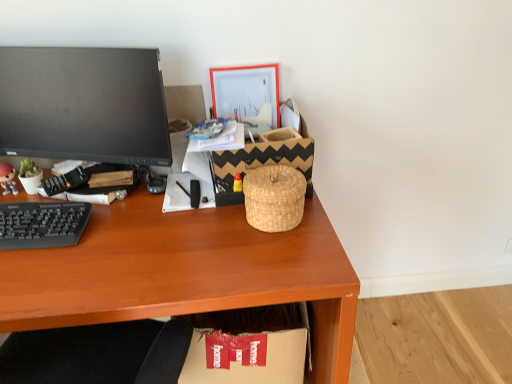
Identify the location of free space in front of woven natural basket at center. The height and width of the screenshot is (384, 512). (278, 263).